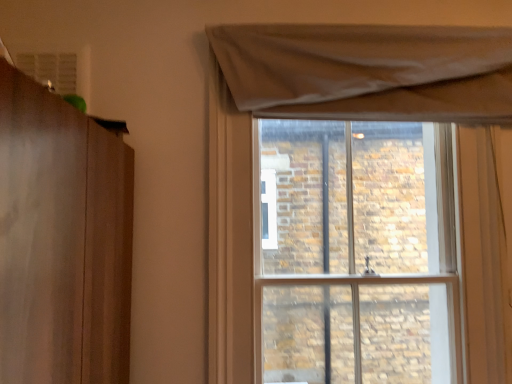
Question: Could you tell me if matte beige curtain at upper right is facing brown stone wall at upper center?

Choices:
 (A) no
 (B) yes

Answer: (A)

Question: Is matte beige curtain at upper right further to the viewer compared to brown stone wall at upper center?

Choices:
 (A) no
 (B) yes

Answer: (A)

Question: Does matte beige curtain at upper right have a lesser width compared to brown stone wall at upper center?

Choices:
 (A) no
 (B) yes

Answer: (B)

Question: Considering the relative positions of matte beige curtain at upper right and brown stone wall at upper center in the image provided, is matte beige curtain at upper right to the right of brown stone wall at upper center from the viewer's perspective?

Choices:
 (A) no
 (B) yes

Answer: (A)

Question: Can we say matte beige curtain at upper right lies outside brown stone wall at upper center?

Choices:
 (A) no
 (B) yes

Answer: (B)

Question: Does matte beige curtain at upper right have a greater width compared to brown stone wall at upper center?

Choices:
 (A) no
 (B) yes

Answer: (A)

Question: Does brown stone wall at upper center turn towards matte beige curtain at upper right?

Choices:
 (A) no
 (B) yes

Answer: (B)

Question: Considering the relative positions of brown stone wall at upper center and matte beige curtain at upper right in the image provided, is brown stone wall at upper center to the left of matte beige curtain at upper right from the viewer's perspective?

Choices:
 (A) no
 (B) yes

Answer: (A)

Question: Considering the relative sizes of brown stone wall at upper center and matte beige curtain at upper right in the image provided, is brown stone wall at upper center thinner than matte beige curtain at upper right?

Choices:
 (A) yes
 (B) no

Answer: (B)

Question: Considering the relative sizes of brown stone wall at upper center and matte beige curtain at upper right in the image provided, is brown stone wall at upper center bigger than matte beige curtain at upper right?

Choices:
 (A) no
 (B) yes

Answer: (B)

Question: Is brown stone wall at upper center shorter than matte beige curtain at upper right?

Choices:
 (A) yes
 (B) no

Answer: (B)

Question: Is brown stone wall at upper center looking in the opposite direction of matte beige curtain at upper right?

Choices:
 (A) yes
 (B) no

Answer: (B)

Question: From a real-world perspective, is matte beige curtain at upper right positioned above or below brown stone wall at upper center?

Choices:
 (A) above
 (B) below

Answer: (A)